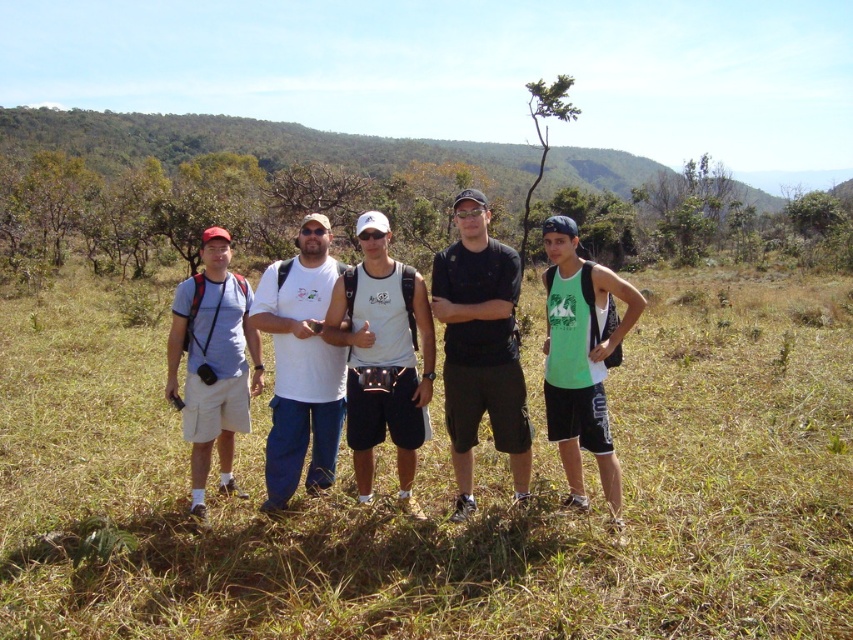
Which is behind, point (482, 289) or point (303, 412)?

Positioned behind is point (303, 412).

Can you confirm if black matte t-shirt at center is wider than white cotton t-shirt at center?

Correct, the width of black matte t-shirt at center exceeds that of white cotton t-shirt at center.

What do you see at coordinates (480, 348) in the screenshot?
I see `black matte t-shirt at center` at bounding box center [480, 348].

In order to click on black matte t-shirt at center in this screenshot , I will do `click(480, 348)`.

How much distance is there between green grassy field at center and matte blue shirt at left?

green grassy field at center and matte blue shirt at left are 8.82 meters apart.

Who is more distant from viewer, [840,378] or [213,376]?

The point [840,378] is behind.

Who is more distant from viewer, (x=746, y=324) or (x=241, y=368)?

The point (x=746, y=324) is more distant.

This screenshot has width=853, height=640. I want to click on green grassy field at center, so click(x=444, y=488).

Is white mesh tank top at center further to camera compared to matte blue shirt at left?

No.

Between white mesh tank top at center and matte blue shirt at left, which one appears on the left side from the viewer's perspective?

matte blue shirt at left

Which is in front, point (425, 330) or point (201, 321)?

Point (425, 330) is more forward.

Locate an element on the screen. This screenshot has width=853, height=640. white mesh tank top at center is located at coordinates (383, 355).